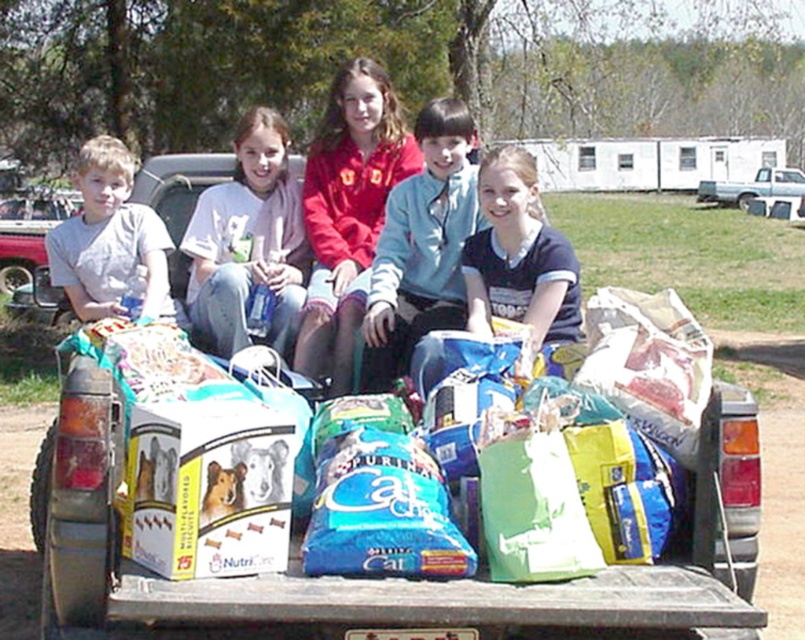
Question: Among these objects, which one is nearest to the camera?

Choices:
 (A) matte plastic bottle at center
 (B) red fleece jacket at center
 (C) white cotton shirt at center
 (D) light blue fleece jacket at center

Answer: (A)

Question: Does white cotton shirt at center lie behind light blue fleece jacket at center?

Choices:
 (A) yes
 (B) no

Answer: (A)

Question: Which object is the closest to the matte gray shirt at left?

Choices:
 (A) matte plastic bottle at center
 (B) light blue fleece jacket at center

Answer: (A)

Question: Can you confirm if matte plastic bottle at center is smaller than matte gray shirt at left?

Choices:
 (A) no
 (B) yes

Answer: (A)

Question: Is white cotton shirt at center closer to camera compared to dark blue t-shirt at center?

Choices:
 (A) yes
 (B) no

Answer: (B)

Question: Which object is closer to the camera taking this photo?

Choices:
 (A) red fleece jacket at center
 (B) dark blue t-shirt at center
 (C) matte gray shirt at left
 (D) matte plastic bottle at center

Answer: (B)